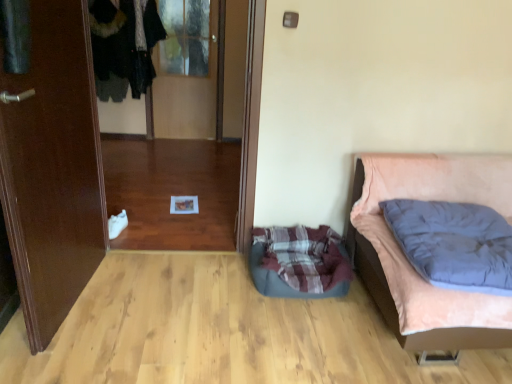
Question: Would you say brown wooden door at left is to the left or to the right of velvet-like black coat at upper left in the picture?

Choices:
 (A) right
 (B) left

Answer: (A)

Question: In the image, is brown wooden door at left positioned in front of or behind velvet-like black coat at upper left?

Choices:
 (A) behind
 (B) front

Answer: (B)

Question: Based on their relative distances, which object is nearer to the transparent glass door at upper center, the first glass door viewed from the top?

Choices:
 (A) plaid fabric dog bed at lower center
 (B) dark blue quilted pillow at right
 (C) velvet-like black coat at upper left
 (D) transparent glass door at center, arranged as the 1th glass door when ordered from the bottom
 (E) brown wooden door at left

Answer: (C)

Question: Which is farther from the transparent glass door at upper center, which is the second glass door in bottom-to-top order?

Choices:
 (A) plaid fabric dog bed at lower center
 (B) dark blue quilted pillow at right
 (C) brown wooden door at left
 (D) transparent glass door at center, arranged as the 1th glass door when ordered from the bottom
 (E) velvet pink bed at right

Answer: (B)